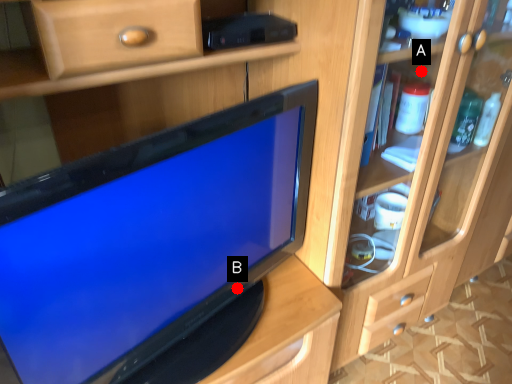
Question: Two points are circled on the image, labeled by A and B beside each circle. Which point appears farthest from the camera in this image?

Choices:
 (A) A is further
 (B) B is further

Answer: (A)